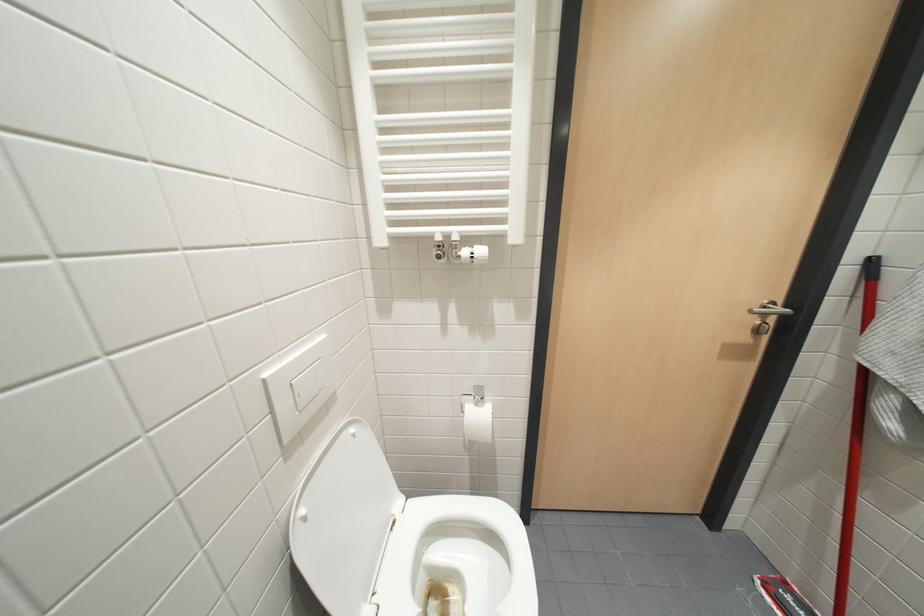
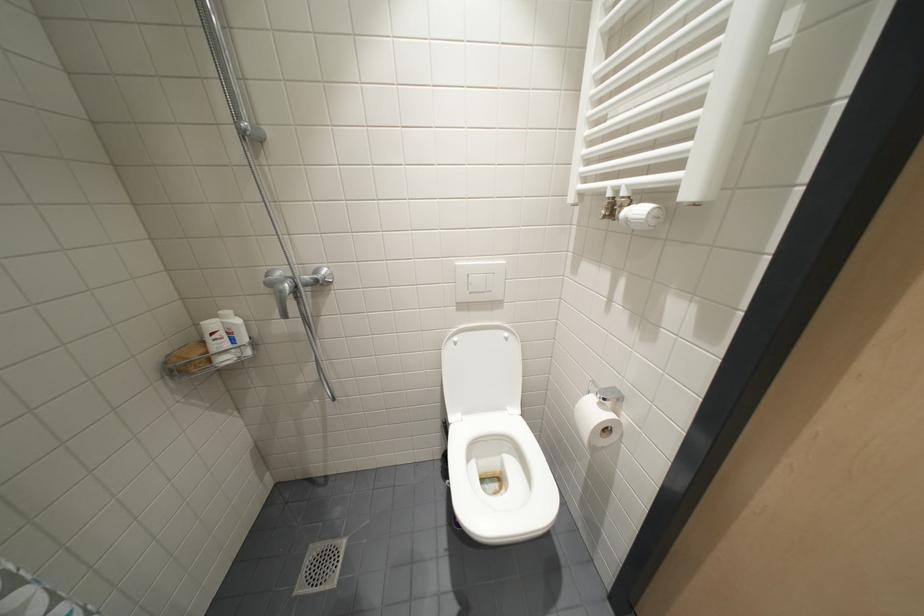
The first image is from the beginning of the video and the second image is from the end. How did the camera likely rotate when shooting the video?

The camera rotated toward left-down.